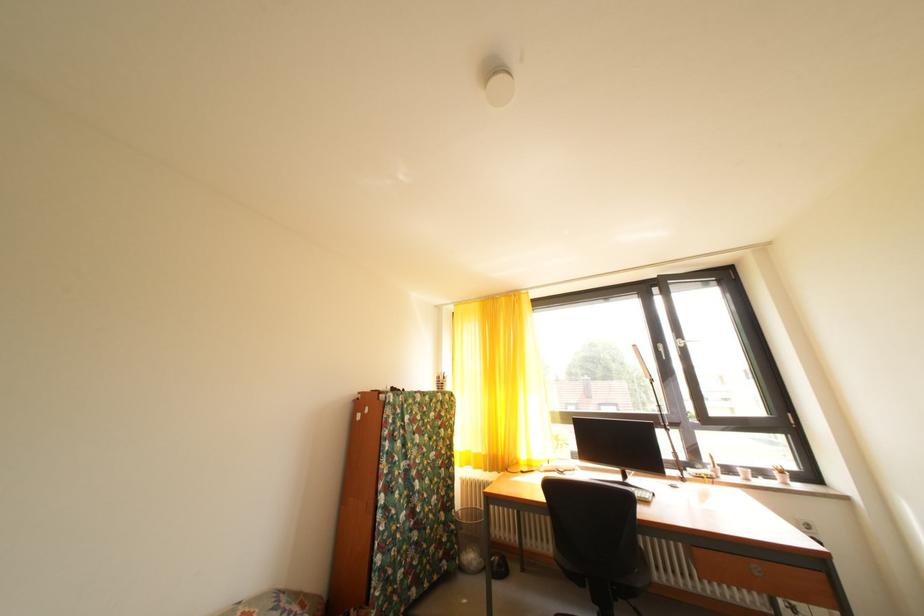
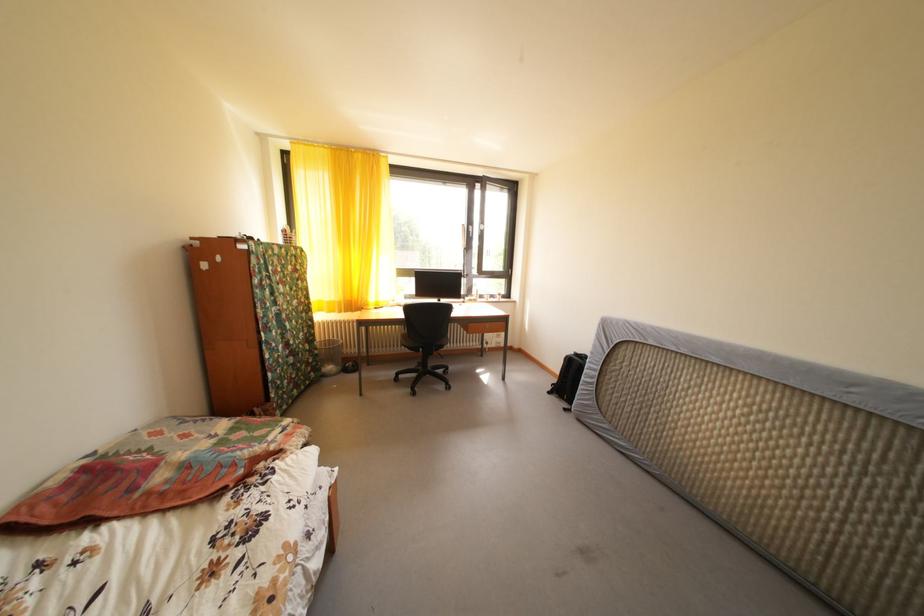
How did the camera likely rotate?

The camera rotated toward right-down.